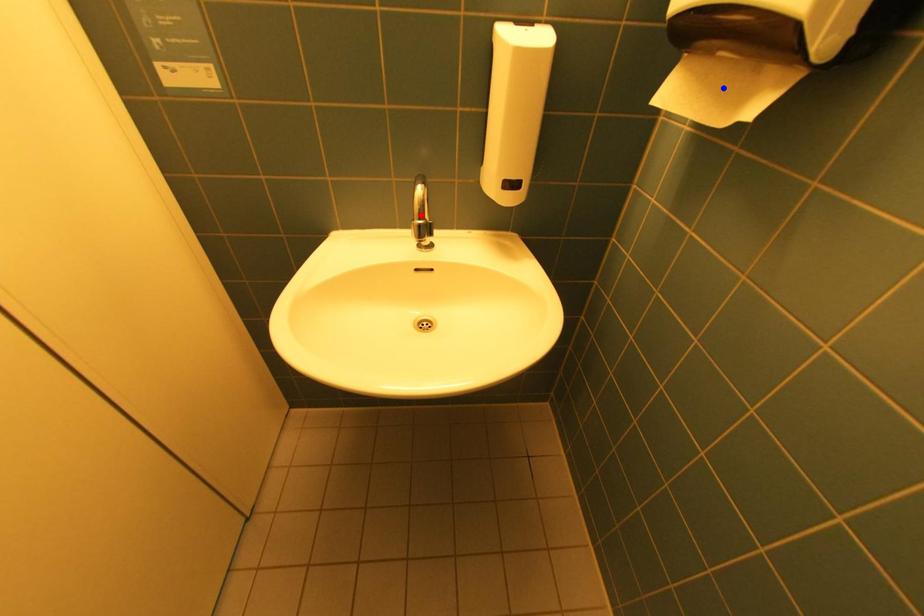
Question: Two points are marked on the image. Which point is closer to the camera?

Choices:
 (A) Blue point is closer.
 (B) Red point is closer.

Answer: (A)